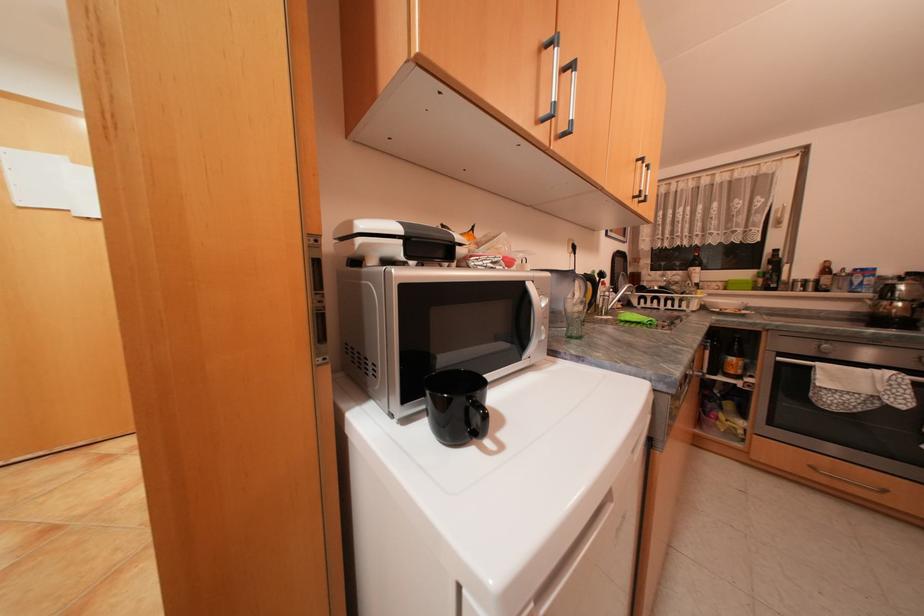
Where would you pull the oven door handle? Please return your answer as a coordinate pair (x, y).

(832, 367)